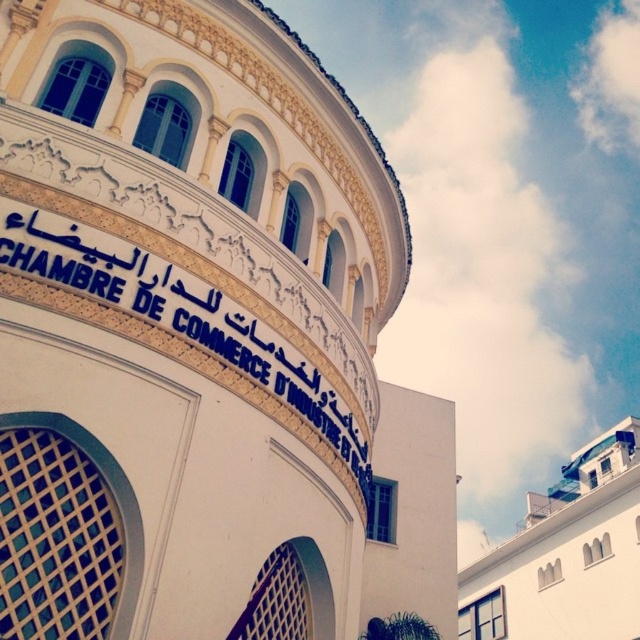
Is point (321, 195) closer to viewer compared to point (620, 618)?

Yes, point (321, 195) is closer to viewer.

Is white stone building at center smaller than white matte building at upper right?

Correct, white stone building at center occupies less space than white matte building at upper right.

Is point (32, 300) closer to camera compared to point (634, 538)?

That is True.

Identify the location of white stone building at center. This screenshot has height=640, width=640. (202, 339).

Is white stone building at center shorter than white painted signboard at center?

Incorrect, white stone building at center's height does not fall short of white painted signboard at center's.

I want to click on white stone building at center, so click(202, 339).

Which is behind, point (188, 64) or point (108, 285)?

Positioned behind is point (188, 64).

The height and width of the screenshot is (640, 640). Find the location of `white stone building at center`. white stone building at center is located at coordinates (202, 339).

Does white matte building at upper right appear over white painted signboard at center?

No.

Locate an element on the screen. white matte building at upper right is located at coordinates (566, 554).